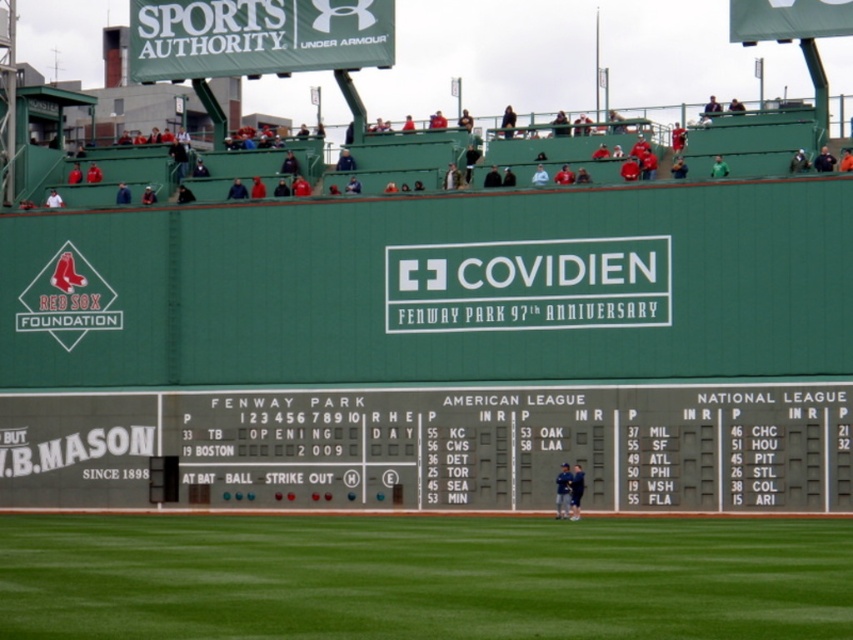
How much distance is there between gray metal scoreboard at center and blue uniform at center?

They are 27.05 feet apart.

Does gray metal scoreboard at center have a greater height compared to blue uniform at center?

Yes.

Is point (86, 408) positioned after point (577, 497)?

That is True.

This screenshot has height=640, width=853. Find the location of `gray metal scoreboard at center`. gray metal scoreboard at center is located at coordinates (437, 445).

Can you confirm if green grass at lower center is positioned to the right of blue uniform at center?

Incorrect, green grass at lower center is not on the right side of blue uniform at center.

This screenshot has height=640, width=853. In order to click on green grass at lower center in this screenshot , I will do `click(422, 577)`.

Based on the photo, measure the distance from dark blue uniform at center to blue uniform at center.

dark blue uniform at center and blue uniform at center are 9.49 inches apart from each other.

This screenshot has height=640, width=853. What do you see at coordinates (563, 490) in the screenshot? I see `dark blue uniform at center` at bounding box center [563, 490].

In order to click on dark blue uniform at center in this screenshot , I will do `click(563, 490)`.